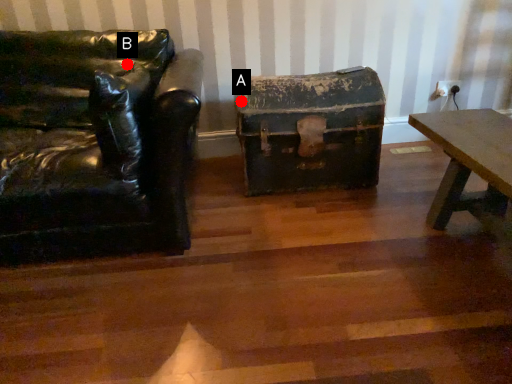
Question: Two points are circled on the image, labeled by A and B beside each circle. Which point appears closest to the camera in this image?

Choices:
 (A) A is closer
 (B) B is closer

Answer: (B)